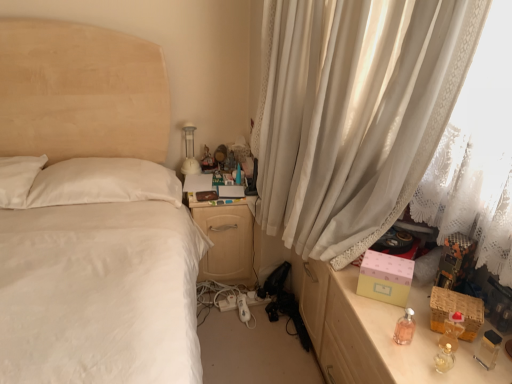
Question: Does pink glass perfume at lower right, which is the second perfume in right-to-left order, have a larger size compared to translucent amber bottle at right, which is the first perfume from right to left?

Choices:
 (A) yes
 (B) no

Answer: (B)

Question: Can you confirm if pink glass perfume at lower right, the first perfume in the left-to-right sequence, is positioned to the right of translucent amber bottle at right, which is the first perfume from right to left?

Choices:
 (A) yes
 (B) no

Answer: (B)

Question: Considering the relative positions of pink glass perfume at lower right, which is the second perfume in right-to-left order, and translucent amber bottle at right, the 2th perfume in the left-to-right sequence, in the image provided, is pink glass perfume at lower right, which is the second perfume in right-to-left order, behind translucent amber bottle at right, the 2th perfume in the left-to-right sequence,?

Choices:
 (A) yes
 (B) no

Answer: (A)

Question: Is pink glass perfume at lower right, which is the second perfume in right-to-left order, not inside translucent amber bottle at right, the 2th perfume in the left-to-right sequence?

Choices:
 (A) no
 (B) yes

Answer: (B)

Question: Is pink glass perfume at lower right, which is the second perfume in right-to-left order, oriented towards translucent amber bottle at right, which is the first perfume from right to left?

Choices:
 (A) no
 (B) yes

Answer: (A)

Question: Does pink glass perfume at lower right, which is the second perfume in right-to-left order, have a lesser width compared to translucent amber bottle at right, which is the first perfume from right to left?

Choices:
 (A) no
 (B) yes

Answer: (B)

Question: Does matte pink box at right have a smaller size compared to white sheer curtain at right?

Choices:
 (A) yes
 (B) no

Answer: (A)

Question: Does matte pink box at right have a lesser height compared to white sheer curtain at right?

Choices:
 (A) yes
 (B) no

Answer: (A)

Question: Is the surface of matte pink box at right in direct contact with white sheer curtain at right?

Choices:
 (A) no
 (B) yes

Answer: (A)

Question: Could you tell me if matte pink box at right is turned towards white sheer curtain at right?

Choices:
 (A) no
 (B) yes

Answer: (A)

Question: Considering the relative positions of matte pink box at right and white sheer curtain at right in the image provided, is matte pink box at right behind white sheer curtain at right?

Choices:
 (A) no
 (B) yes

Answer: (B)

Question: From the image's perspective, would you say matte pink box at right is positioned over white sheer curtain at right?

Choices:
 (A) no
 (B) yes

Answer: (A)

Question: Is translucent amber bottle at right, the 2th perfume in the left-to-right sequence, positioned behind pink glass perfume at lower right, which is the second perfume in right-to-left order?

Choices:
 (A) yes
 (B) no

Answer: (B)